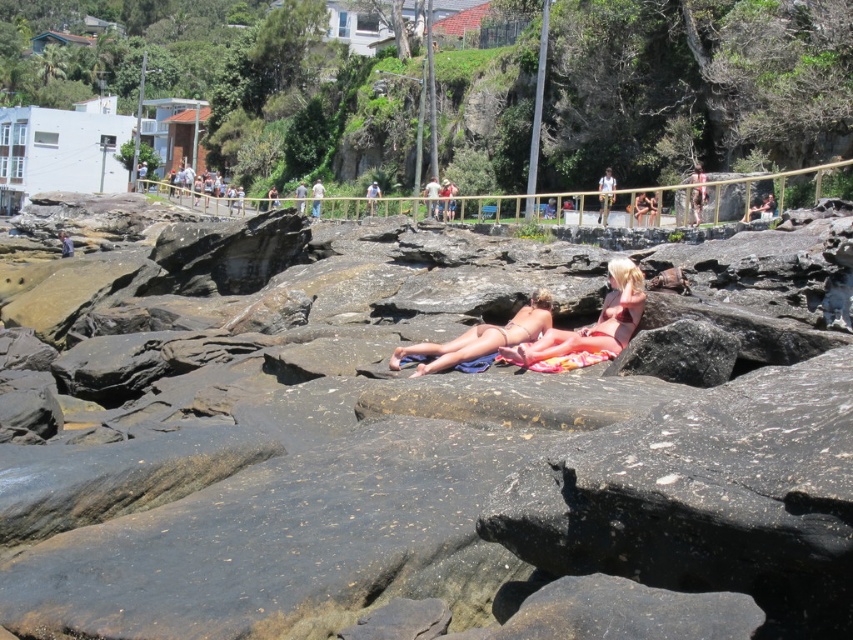
Does pink fabric bikini at center appear on the right side of light brown wooden post at center?

Yes, pink fabric bikini at center is to the right of light brown wooden post at center.

Between point (616, 337) and point (312, 204), which one is positioned behind?

Positioned behind is point (312, 204).

The image size is (853, 640). Identify the location of pink fabric bikini at center. (589, 326).

Who is higher up, smooth gray rock at center or matte pink bikini at center?

matte pink bikini at center is higher up.

Can you confirm if smooth gray rock at center is positioned to the left of matte pink bikini at center?

Incorrect, smooth gray rock at center is not on the left side of matte pink bikini at center.

Locate an element on the screen. smooth gray rock at center is located at coordinates (409, 445).

I want to click on smooth gray rock at center, so click(409, 445).

Can you confirm if smooth gray rock at center is wider than light brown leather jacket at upper center?

Yes.

Locate an element on the screen. smooth gray rock at center is located at coordinates (409, 445).

Who is more distant from viewer, (392, 216) or (599, 218)?

The point (392, 216) is behind.

Where is `smooth gray rock at center`? This screenshot has width=853, height=640. smooth gray rock at center is located at coordinates (409, 445).